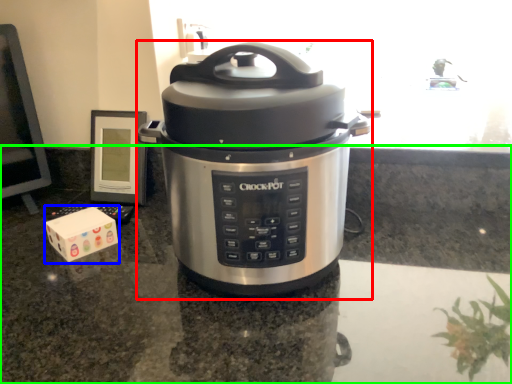
Question: Which object is the closest to the slow cooker (highlighted by a red box)? Choose among these: block (highlighted by a blue box) or counter top (highlighted by a green box).

Choices:
 (A) block
 (B) counter top

Answer: (B)